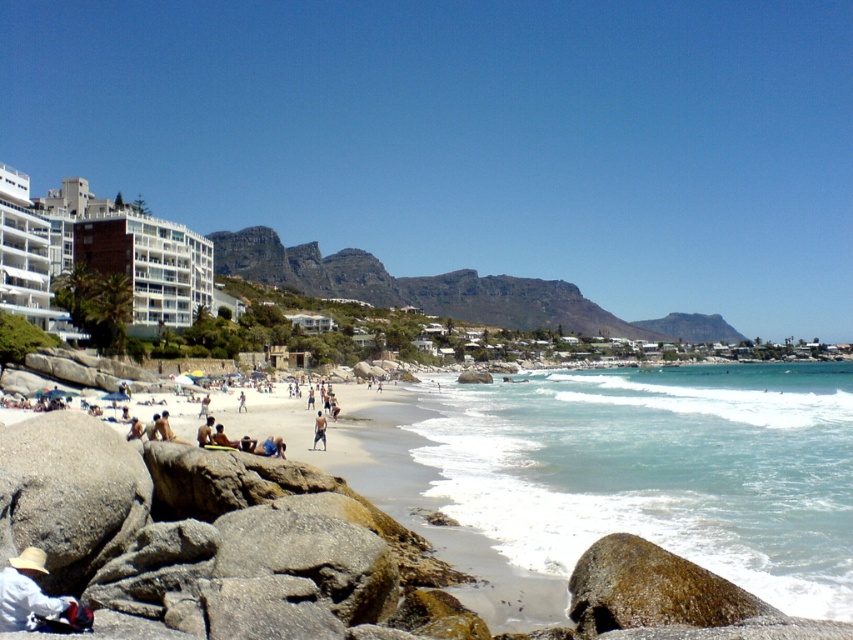
Describe the element at coordinates (68, 492) in the screenshot. I see `gray rough boulder at lower left` at that location.

Can you confirm if gray rough boulder at lower left is shorter than skinny man at center?

No, gray rough boulder at lower left is not shorter than skinny man at center.

Who is more distant from viewer, [65,508] or [315,428]?

The point [315,428] is more distant.

What are the coordinates of `gray rough boulder at lower left` in the screenshot? It's located at (68, 492).

What do you see at coordinates (660, 470) in the screenshot? This screenshot has height=640, width=853. I see `clear blue water at beach right` at bounding box center [660, 470].

Describe the element at coordinates (660, 470) in the screenshot. I see `clear blue water at beach right` at that location.

Where is `clear blue water at beach right`? The image size is (853, 640). clear blue water at beach right is located at coordinates (660, 470).

Can you confirm if clear blue water at beach right is positioned above gray rough boulder at lower left?

Actually, clear blue water at beach right is below gray rough boulder at lower left.

Is clear blue water at beach right wider than gray rough boulder at lower left?

Answer: Correct, the width of clear blue water at beach right exceeds that of gray rough boulder at lower left.

Where is `clear blue water at beach right`? clear blue water at beach right is located at coordinates (660, 470).